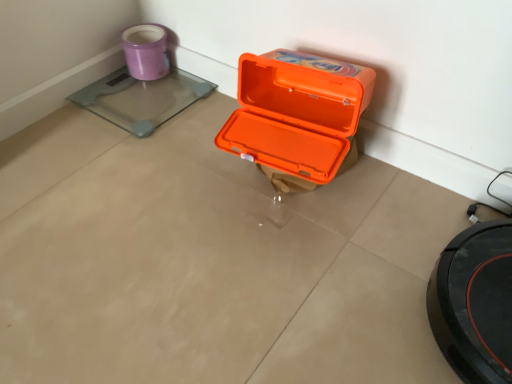
Question: Is transparent glass scale at upper left facing towards matte purple mug at upper left?

Choices:
 (A) yes
 (B) no

Answer: (B)

Question: From a real-world perspective, is transparent glass scale at upper left on matte purple mug at upper left?

Choices:
 (A) yes
 (B) no

Answer: (B)

Question: Is transparent glass scale at upper left shorter than matte purple mug at upper left?

Choices:
 (A) yes
 (B) no

Answer: (A)

Question: Is transparent glass scale at upper left bigger than matte purple mug at upper left?

Choices:
 (A) no
 (B) yes

Answer: (B)

Question: Is transparent glass scale at upper left next to matte purple mug at upper left and touching it?

Choices:
 (A) yes
 (B) no

Answer: (A)

Question: Is matte purple mug at upper left in front of or behind transparent glass scale at upper left in the image?

Choices:
 (A) front
 (B) behind

Answer: (B)

Question: In terms of size, does matte purple mug at upper left appear bigger or smaller than transparent glass scale at upper left?

Choices:
 (A) big
 (B) small

Answer: (B)

Question: From the image's perspective, is matte purple mug at upper left above or below transparent glass scale at upper left?

Choices:
 (A) below
 (B) above

Answer: (B)

Question: Is matte purple mug at upper left wider or thinner than transparent glass scale at upper left?

Choices:
 (A) wide
 (B) thin

Answer: (B)

Question: Is transparent glass scale at upper left in front of or behind matte purple mug at upper left in the image?

Choices:
 (A) front
 (B) behind

Answer: (A)

Question: From a real-world perspective, is transparent glass scale at upper left above or below matte purple mug at upper left?

Choices:
 (A) above
 (B) below

Answer: (B)

Question: From the image's perspective, is transparent glass scale at upper left above or below matte purple mug at upper left?

Choices:
 (A) below
 (B) above

Answer: (A)

Question: Is transparent glass scale at upper left taller or shorter than matte purple mug at upper left?

Choices:
 (A) short
 (B) tall

Answer: (A)

Question: From a real-world perspective, is orange plastic box at center physically located above or below transparent glass scale at upper left?

Choices:
 (A) below
 (B) above

Answer: (B)

Question: Choose the correct answer: Is orange plastic box at center inside transparent glass scale at upper left or outside it?

Choices:
 (A) outside
 (B) inside

Answer: (A)